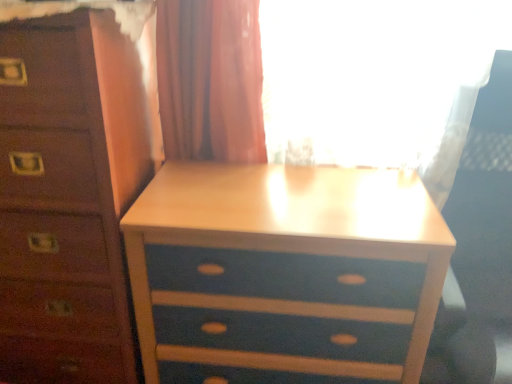
Question: Looking at their shapes, would you say white plastic swivel chair at right is wider or thinner than blue painted wood nightstand at center?

Choices:
 (A) wide
 (B) thin

Answer: (A)

Question: Is white plastic swivel chair at right to the left or to the right of blue painted wood nightstand at center in the image?

Choices:
 (A) right
 (B) left

Answer: (A)

Question: Considering the real-world distances, which object is farthest from the white plastic swivel chair at right?

Choices:
 (A) blue painted wood chest of drawers at center
 (B) blue painted wood nightstand at center

Answer: (A)

Question: Based on their relative distances, which object is nearer to the blue painted wood nightstand at center?

Choices:
 (A) blue painted wood chest of drawers at center
 (B) white plastic swivel chair at right

Answer: (A)